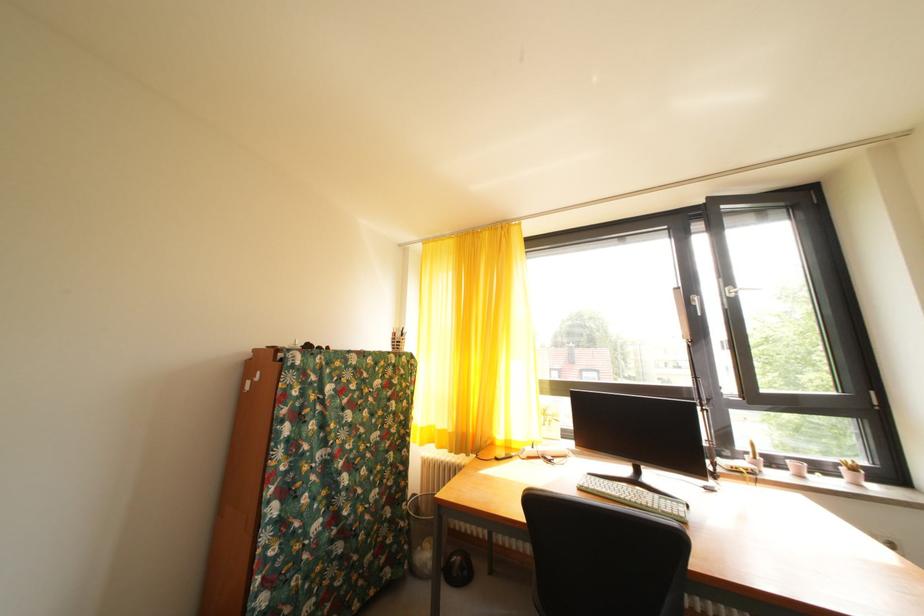
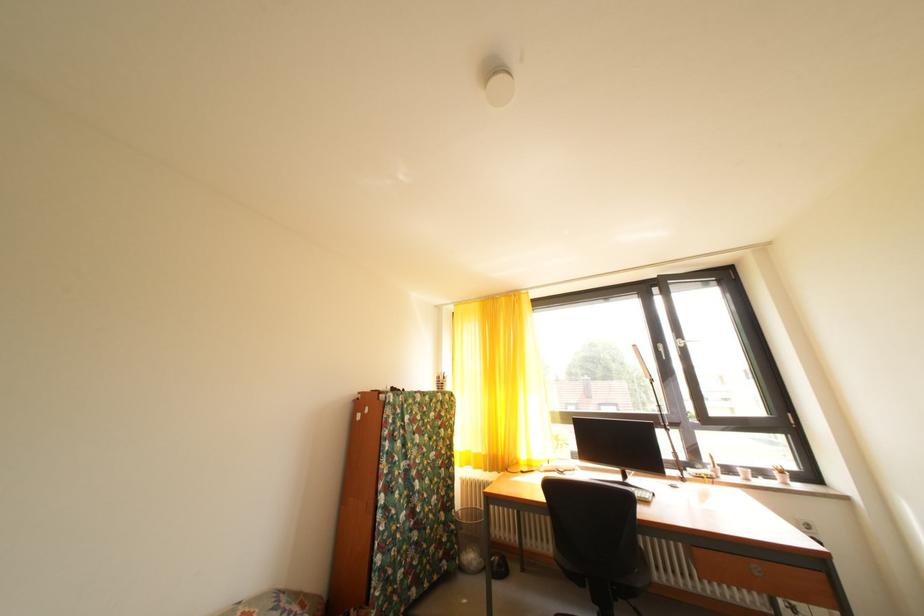
Question: In a continuous first-person perspective shot, in which direction is the camera moving?

Choices:
 (A) Left
 (B) Right
 (C) Forward
 (D) Backward

Answer: (D)